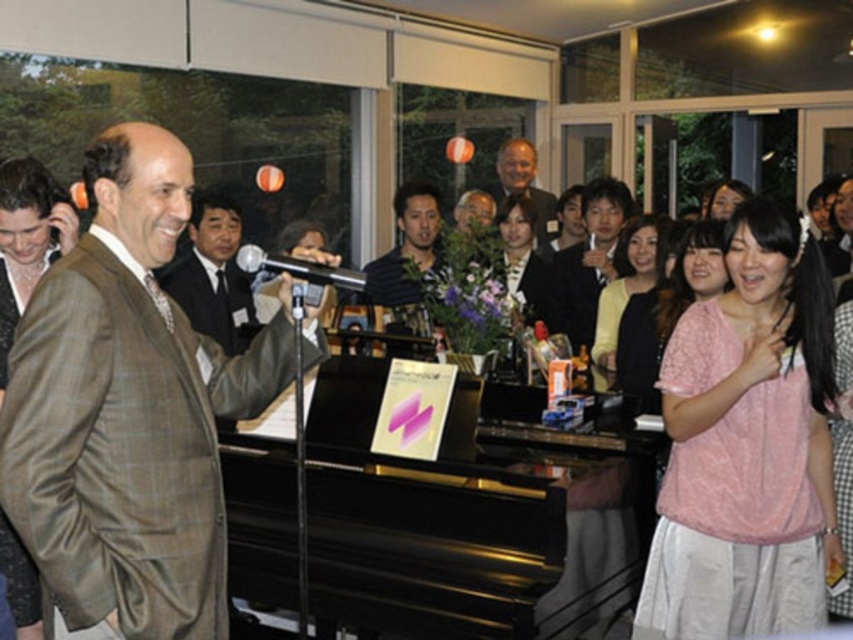
Does brown checkered suit at left appear on the right side of pink textured blouse at lower right?

In fact, brown checkered suit at left is to the left of pink textured blouse at lower right.

Is brown checkered suit at left in front of pink textured blouse at lower right?

That is True.

Is point (260, 404) positioned after point (695, 266)?

No, it is in front of (695, 266).

Identify the location of brown checkered suit at left. (128, 410).

In the scene shown: Is pink lace blouse at center positioned in front of dark brown suit at center?

Yes, it is in front of dark brown suit at center.

Between point (827, 563) and point (178, 296), which one is positioned in front?

Positioned in front is point (827, 563).

Between point (640, 605) and point (253, 323), which one is positioned in front?

Point (640, 605)

Where is `pink lace blouse at center`? The width and height of the screenshot is (853, 640). pink lace blouse at center is located at coordinates (747, 445).

Is dark brown suit at center shorter than silver metallic microphone at center?

Incorrect, dark brown suit at center's height does not fall short of silver metallic microphone at center's.

Looking at this image, can you confirm if dark brown suit at center is taller than silver metallic microphone at center?

Indeed, dark brown suit at center has a greater height compared to silver metallic microphone at center.

Who is more distant from viewer, (198, 253) or (288, 268)?

The point (198, 253) is more distant.

Where is `dark brown suit at center`? This screenshot has width=853, height=640. dark brown suit at center is located at coordinates (212, 273).